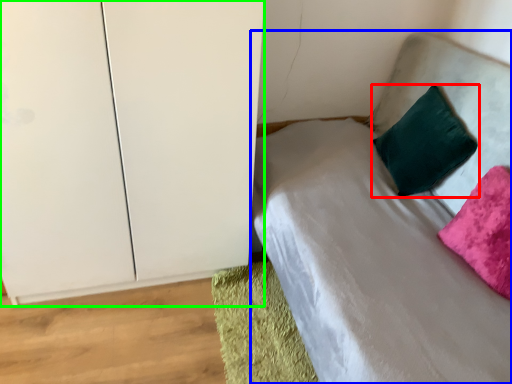
Question: Which object is positioned farthest from pillow (highlighted by a red box)? Select from bed (highlighted by a blue box) and dresser (highlighted by a green box).

Choices:
 (A) bed
 (B) dresser

Answer: (B)